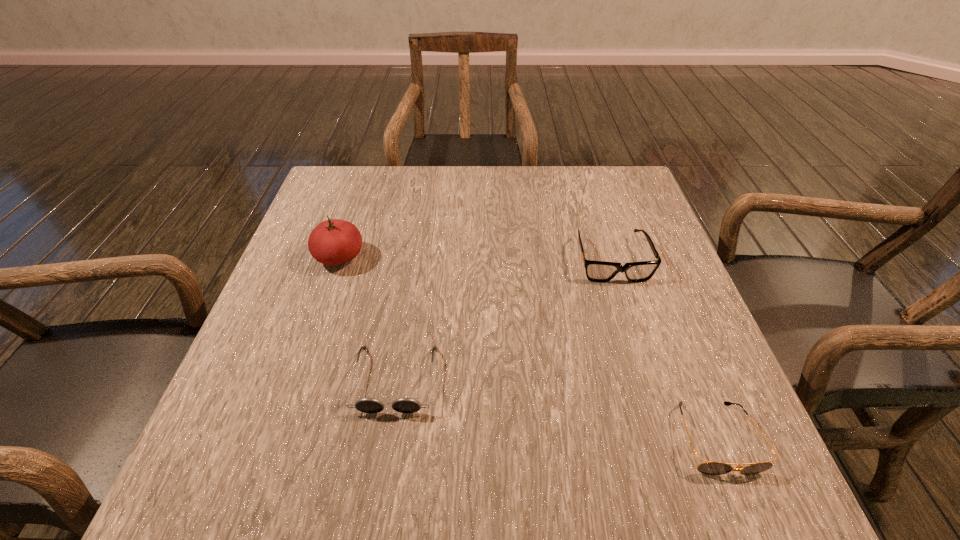
This screenshot has height=540, width=960. Identify the location of empty space that is in between the third object from right to left and the second tallest object. (503, 320).

You are a GUI agent. You are given a task and a screenshot of the screen. Output one action in this format:
    pyautogui.click(x=<x>, y=<y>)
    Task: Click on the free space that is in between the farthest sunglasses and the tomato
    
    Given the screenshot: What is the action you would take?
    pyautogui.click(x=476, y=259)

Where is `unoccupied position between the third object from right to left and the tallest sunglasses`? The width and height of the screenshot is (960, 540). unoccupied position between the third object from right to left and the tallest sunglasses is located at coordinates (503, 320).

The width and height of the screenshot is (960, 540). I want to click on vacant region between the third shortest object and the second object from left to right, so click(503, 320).

Where is `the second closest object relative to the leftmost sunglasses`? the second closest object relative to the leftmost sunglasses is located at coordinates (596, 271).

Choose which object is the nearest neighbor to the tallest sunglasses. Please provide its 2D coordinates. Your answer should be formatted as a tuple, i.e. [(x, y)], where the tuple contains the x and y coordinates of a point satisfying the conditions above.

[(709, 468)]

Locate an element on the screen. Image resolution: width=960 pixels, height=540 pixels. sunglasses that is the third closest to the leftmost object is located at coordinates (709, 468).

Point out which sunglasses is positioned as the nearest to the second tallest object. Please provide its 2D coordinates. Your answer should be formatted as a tuple, i.e. [(x, y)], where the tuple contains the x and y coordinates of a point satisfying the conditions above.

[(709, 468)]